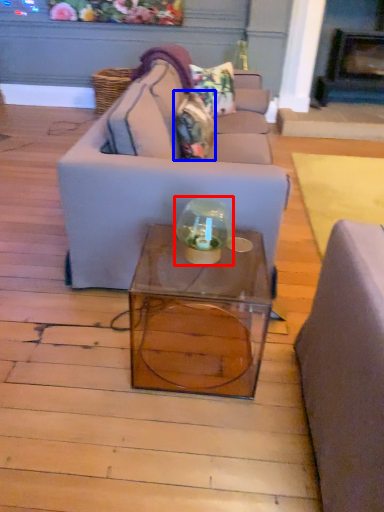
Question: Which object is closer to the camera taking this photo, glass jar (highlighted by a red box) or pillow (highlighted by a blue box)?

Choices:
 (A) glass jar
 (B) pillow

Answer: (A)